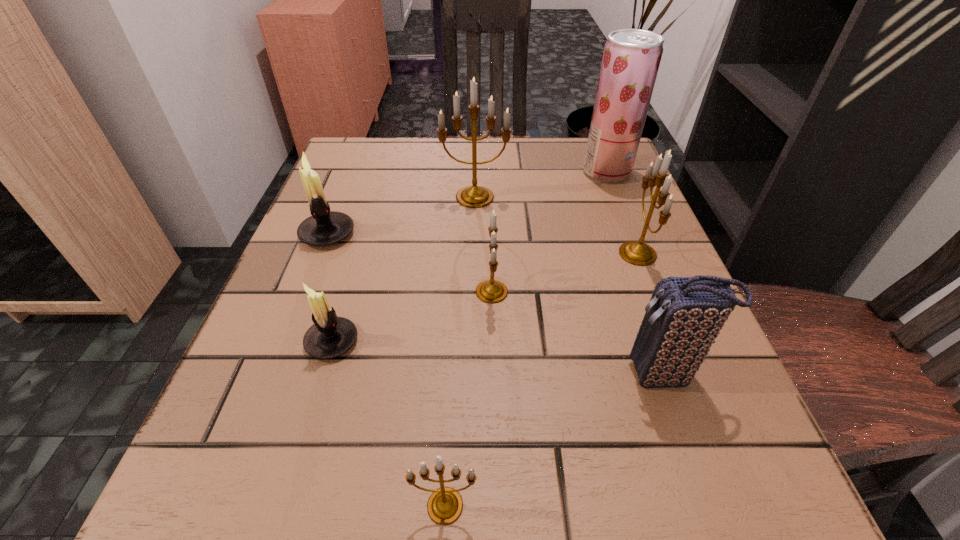
Identify the location of the smaller white candle holder. (330, 336).

You are a GUI agent. You are given a task and a screenshot of the screen. Output one action in this format:
    pyautogui.click(x=<x>, y=<y>)
    Task: Click on the nearest candelabrum
    The image size is (960, 540).
    Given the screenshot: What is the action you would take?
    (x=445, y=505)

I want to click on the nearest object, so click(445, 505).

You are a GUI agent. You are given a task and a screenshot of the screen. Output one action in this format:
    pyautogui.click(x=<x>, y=<y>)
    Task: Click on the free region located 0.250m on the front of the strawberry fruit juice
    The width and height of the screenshot is (960, 540).
    Given the screenshot: What is the action you would take?
    pyautogui.click(x=641, y=260)

Where is `vacant area situated on the front of the biggest gold candelabrum`? Image resolution: width=960 pixels, height=540 pixels. vacant area situated on the front of the biggest gold candelabrum is located at coordinates 473,323.

Locate an element on the screen. This screenshot has height=540, width=960. free region located 0.150m on the front of the rightmost gold candelabrum is located at coordinates (673, 346).

Identify the location of vacant space located with the zip open on the clutch bag. (510, 375).

Find the location of a particular element. This screenshot has width=960, height=540. vacant area located 0.290m with the zip open on the clutch bag is located at coordinates (418, 375).

Identify the location of free space located 0.390m with the zip open on the clutch bag. (348, 375).

You are a GUI agent. You are given a task and a screenshot of the screen. Output one action in this format:
    pyautogui.click(x=<x>, y=<y>)
    Task: Click on the vacant space located 0.050m on the back of the bigger white candle holder
    
    Given the screenshot: What is the action you would take?
    pyautogui.click(x=340, y=203)